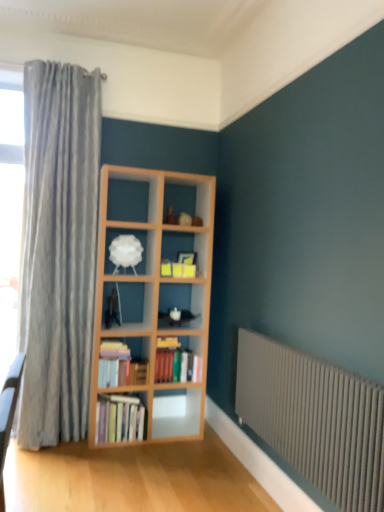
Question: Should I look upward or downward to see hardcover books at center, placed as the second book when sorted from top to bottom?

Choices:
 (A) up
 (B) down

Answer: (B)

Question: Is hardcover books at center-left, the 3th book positioned from the bottom, positioned beyond the bounds of white matte lampshade at center?

Choices:
 (A) no
 (B) yes

Answer: (B)

Question: Considering the relative positions of hardcover books at center-left, which is counted as the 1th book, starting from the top, and white matte lampshade at center in the image provided, is hardcover books at center-left, which is counted as the 1th book, starting from the top, to the left of white matte lampshade at center from the viewer's perspective?

Choices:
 (A) yes
 (B) no

Answer: (A)

Question: Can you confirm if hardcover books at center-left, the 3th book positioned from the bottom, is positioned to the right of white matte lampshade at center?

Choices:
 (A) yes
 (B) no

Answer: (B)

Question: Is white matte lampshade at center completely or partially inside hardcover books at center-left, the 3th book positioned from the bottom?

Choices:
 (A) yes
 (B) no

Answer: (B)

Question: Is the position of hardcover books at center-left, which is counted as the 1th book, starting from the top, more distant than that of white matte lampshade at center?

Choices:
 (A) no
 (B) yes

Answer: (A)

Question: Is hardcover books at center-left, which is counted as the 1th book, starting from the top, bigger than white matte lampshade at center?

Choices:
 (A) yes
 (B) no

Answer: (A)

Question: Can you confirm if hardcover books at center, arranged as the first book when ordered from the bottom, is shorter than white matte lampshade at center?

Choices:
 (A) no
 (B) yes

Answer: (A)

Question: Can you confirm if hardcover books at center, arranged as the first book when ordered from the bottom, is smaller than white matte lampshade at center?

Choices:
 (A) yes
 (B) no

Answer: (B)

Question: Is hardcover books at center, which is the third book from top to bottom, facing away from white matte lampshade at center?

Choices:
 (A) yes
 (B) no

Answer: (B)

Question: Can you confirm if hardcover books at center, which is the third book from top to bottom, is taller than white matte lampshade at center?

Choices:
 (A) no
 (B) yes

Answer: (B)

Question: Does hardcover books at center, which is the third book from top to bottom, come in front of white matte lampshade at center?

Choices:
 (A) no
 (B) yes

Answer: (B)

Question: Is hardcover books at center, arranged as the first book when ordered from the bottom, facing towards white matte lampshade at center?

Choices:
 (A) no
 (B) yes

Answer: (A)

Question: Does hardcover books at center, placed as the second book when sorted from top to bottom, contain gray metallic radiator at lower right?

Choices:
 (A) yes
 (B) no

Answer: (B)